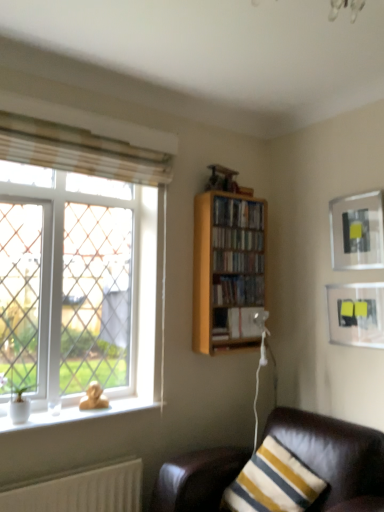
Question: Is the position of wooden bookshelf at center, which is the fourth book in bottom-to-top order, more distant than that of wooden bookshelf at upper right, the 3th book from the bottom?

Choices:
 (A) no
 (B) yes

Answer: (B)

Question: Is wooden bookshelf at center, the second book when ordered from top to bottom, not inside wooden bookshelf at upper right, the third book in the top-to-bottom sequence?

Choices:
 (A) yes
 (B) no

Answer: (A)

Question: Is wooden bookshelf at center, which is the fourth book in bottom-to-top order, positioned before wooden bookshelf at upper right, the 3th book from the bottom?

Choices:
 (A) no
 (B) yes

Answer: (A)

Question: From the image's perspective, would you say wooden bookshelf at center, the second book when ordered from top to bottom, is positioned over wooden bookshelf at upper right, the 3th book from the bottom?

Choices:
 (A) no
 (B) yes

Answer: (B)

Question: Does wooden bookshelf at center, the second book when ordered from top to bottom, have a lesser width compared to wooden bookshelf at upper right, the third book in the top-to-bottom sequence?

Choices:
 (A) no
 (B) yes

Answer: (B)

Question: Considering the relative sizes of wooden bookshelf at center, the second book when ordered from top to bottom, and wooden bookshelf at upper right, the 3th book from the bottom, in the image provided, is wooden bookshelf at center, the second book when ordered from top to bottom, bigger than wooden bookshelf at upper right, the 3th book from the bottom,?

Choices:
 (A) no
 (B) yes

Answer: (B)

Question: Can you confirm if beige fabric curtain at upper left is smaller than leather couch at lower right?

Choices:
 (A) yes
 (B) no

Answer: (A)

Question: Can you confirm if beige fabric curtain at upper left is shorter than leather couch at lower right?

Choices:
 (A) yes
 (B) no

Answer: (A)

Question: Is beige fabric curtain at upper left to the left of leather couch at lower right from the viewer's perspective?

Choices:
 (A) no
 (B) yes

Answer: (B)

Question: From the image's perspective, would you say beige fabric curtain at upper left is positioned over leather couch at lower right?

Choices:
 (A) no
 (B) yes

Answer: (B)

Question: Is beige fabric curtain at upper left positioned behind leather couch at lower right?

Choices:
 (A) no
 (B) yes

Answer: (B)

Question: From the image's perspective, is beige fabric curtain at upper left below leather couch at lower right?

Choices:
 (A) no
 (B) yes

Answer: (A)

Question: Is wooden bookshelf at center, which is the fourth book in bottom-to-top order, oriented towards white glass window at left?

Choices:
 (A) yes
 (B) no

Answer: (B)